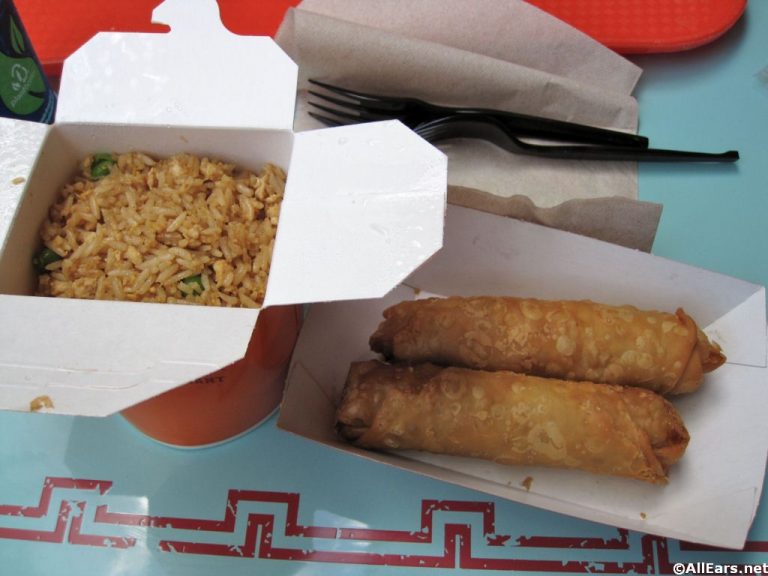
Where is `design on bottom of table`? The width and height of the screenshot is (768, 576). design on bottom of table is located at coordinates (31, 510), (73, 533), (210, 522), (293, 551), (485, 511), (550, 566).